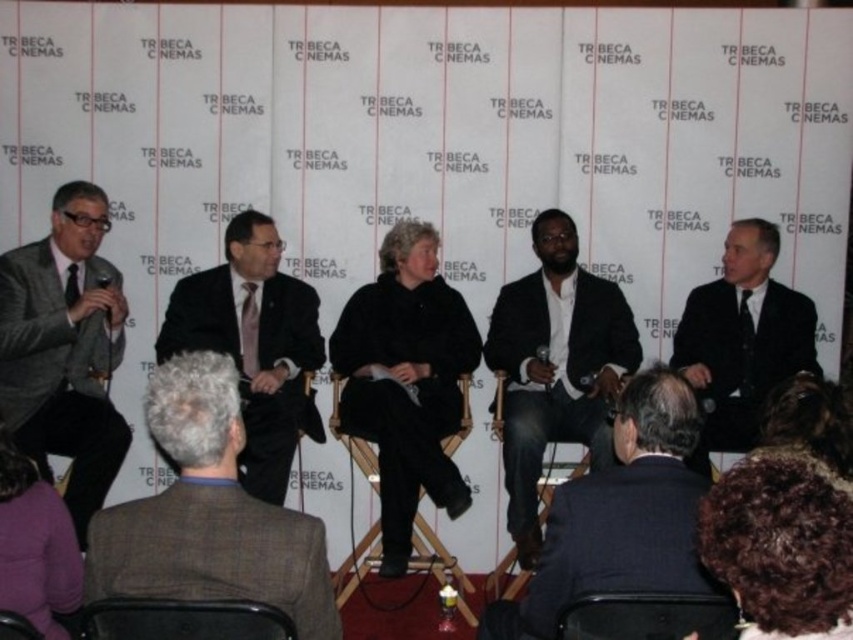
Who is higher up, jeans at center or black leather chair at lower center?

jeans at center is higher up.

Locate an element on the screen. The image size is (853, 640). jeans at center is located at coordinates (555, 365).

Between point (589, 378) and point (688, 632), which one is positioned in front?

Point (688, 632) is more forward.

At what (x,y) coordinates should I click in order to perform the action: click on jeans at center. Please return your answer as a coordinate pair (x, y). Image resolution: width=853 pixels, height=640 pixels. Looking at the image, I should click on (555, 365).

Who is lower down, black leather chair at lower left or wooden chair at lower left?

wooden chair at lower left is lower down.

Which is more to the left, black leather chair at lower left or wooden chair at lower left?

wooden chair at lower left

In order to click on black leather chair at lower left in this screenshot , I will do `click(183, 620)`.

The height and width of the screenshot is (640, 853). I want to click on black leather chair at lower left, so click(183, 620).

Based on the photo, can you confirm if dark suit at center is positioned to the left of dark curly hair at lower right?

Correct, you'll find dark suit at center to the left of dark curly hair at lower right.

Describe the element at coordinates (625, 509) in the screenshot. I see `dark suit at center` at that location.

You are a GUI agent. You are given a task and a screenshot of the screen. Output one action in this format:
    pyautogui.click(x=<x>, y=<y>)
    Task: Click on the dark suit at center
    
    Given the screenshot: What is the action you would take?
    pyautogui.click(x=625, y=509)